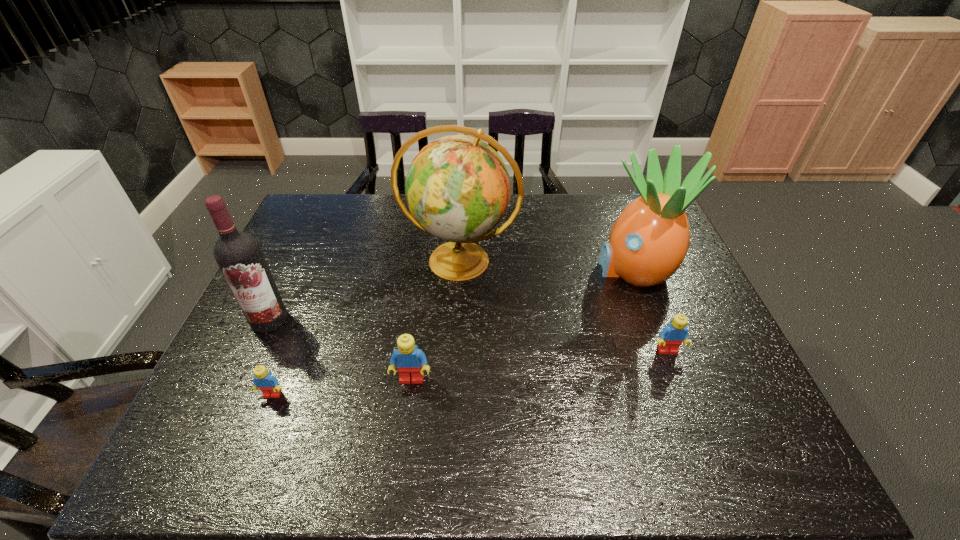
The width and height of the screenshot is (960, 540). In order to click on free area in between the second tallest Lego and the second nearest object in this screenshot , I will do `click(540, 365)`.

At what (x,y) coordinates should I click in order to perform the action: click on vacant region between the nearest Lego and the globe. Please return your answer as a coordinate pair (x, y). Image resolution: width=960 pixels, height=540 pixels. Looking at the image, I should click on (366, 328).

Where is `free area in between the pineapple and the third nearest object`? This screenshot has height=540, width=960. free area in between the pineapple and the third nearest object is located at coordinates (650, 310).

You are a GUI agent. You are given a task and a screenshot of the screen. Output one action in this format:
    pyautogui.click(x=<x>, y=<y>)
    Task: Click on the free space between the pineapple and the fifth tallest object
    This screenshot has height=540, width=960.
    Given the screenshot: What is the action you would take?
    pyautogui.click(x=650, y=310)

Identify the location of vacant space that is in between the shortest object and the second Lego from left to right. (342, 387).

At what (x,y) coordinates should I click in order to perform the action: click on vacant point located between the second Lego from right to left and the pineapple. Please return your answer as a coordinate pair (x, y). Looking at the image, I should click on (522, 324).

At what (x,y) coordinates should I click in order to perform the action: click on vacant area between the second shortest Lego and the globe. Please return your answer as a coordinate pair (x, y). Looking at the image, I should click on (564, 306).

You are a GUI agent. You are given a task and a screenshot of the screen. Output one action in this format:
    pyautogui.click(x=<x>, y=<y>)
    Task: Click on the vacant region between the second tallest Lego and the pineapple
    The height and width of the screenshot is (540, 960).
    Given the screenshot: What is the action you would take?
    pyautogui.click(x=650, y=310)

Identify which object is located as the fourth nearest to the globe. Please provide its 2D coordinates. Your answer should be formatted as a tuple, i.e. [(x, y)], where the tuple contains the x and y coordinates of a point satisfying the conditions above.

[(671, 337)]

Identify which object is the nearest to the globe. Please provide its 2D coordinates. Your answer should be formatted as a tuple, i.e. [(x, y)], where the tuple contains the x and y coordinates of a point satisfying the conditions above.

[(648, 242)]